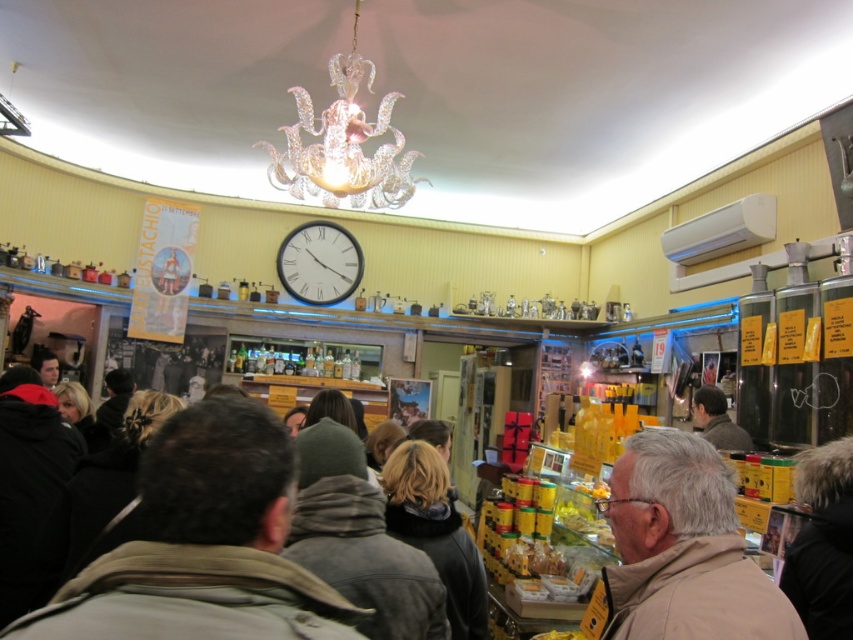
Question: Which point appears closest to the camera in this image?

Choices:
 (A) (680, 529)
 (B) (824, 509)
 (C) (146, 480)

Answer: (C)

Question: Is brown fuzzy jacket at center above white glossy clock at upper center?

Choices:
 (A) no
 (B) yes

Answer: (A)

Question: Which object is positioned closest to the pink glass chandelier at upper center?

Choices:
 (A) dark gray jacket at center
 (B) fuzzy black coat at lower right
 (C) dark brown leather jacket at center

Answer: (C)

Question: Observing the image, what is the correct spatial positioning of dark gray jacket at center in reference to white glossy clock at upper center?

Choices:
 (A) right
 (B) left

Answer: (A)

Question: Can you confirm if fuzzy black coat at lower right is positioned to the left of white glossy clock at upper center?

Choices:
 (A) no
 (B) yes

Answer: (A)

Question: Which of the following is the closest to the observer?

Choices:
 (A) (383, 554)
 (B) (734, 625)
 (C) (418, 508)

Answer: (B)